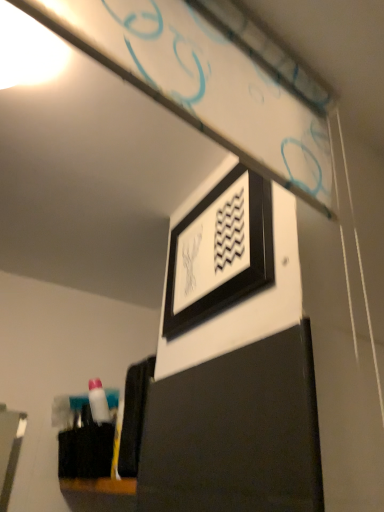
Where is `black matte picture frame at upper center`? The width and height of the screenshot is (384, 512). black matte picture frame at upper center is located at coordinates (222, 250).

The height and width of the screenshot is (512, 384). Describe the element at coordinates (222, 250) in the screenshot. I see `black matte picture frame at upper center` at that location.

Locate an element on the screen. black matte picture frame at upper center is located at coordinates (222, 250).